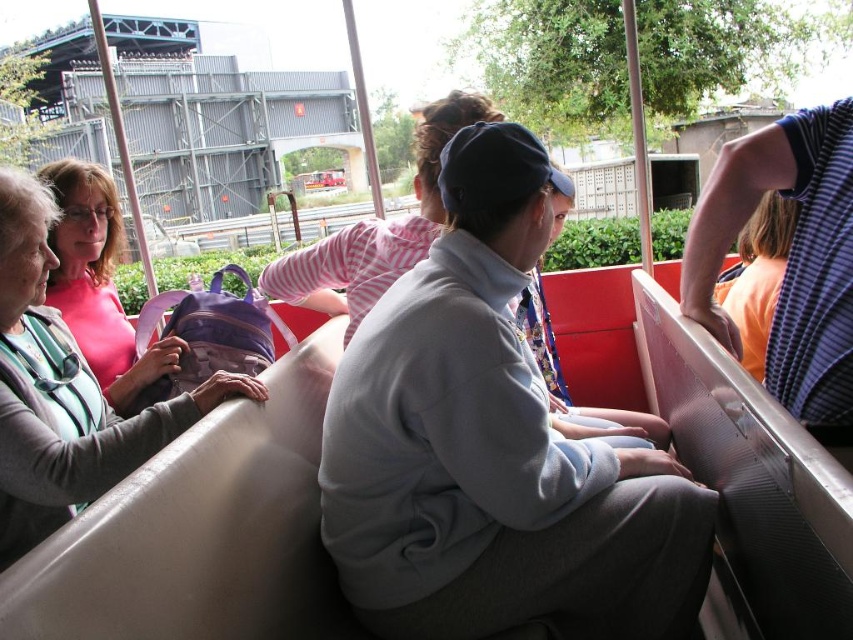
Based on the scene description, where is the light gray fleece jacket at center located in the image?

The light gray fleece jacket at center is located at point (492,448) in the image.

You are standing at the point marked as point (492,448) in the image. What object is directly beneath you?

The point (492,448) is on light gray fleece jacket at center, so the object directly beneath you is the light gray fleece jacket at center.

You are a photographer trying to capture a photo of both the light gray fleece jacket at center and the matte pink shirt at left. Which one should you focus on first to ensure it appears sharp in the photo?

You should focus on the light gray fleece jacket at center first because it is closer to you than the matte pink shirt at left, so focusing on the closer object ensures it will be sharp.